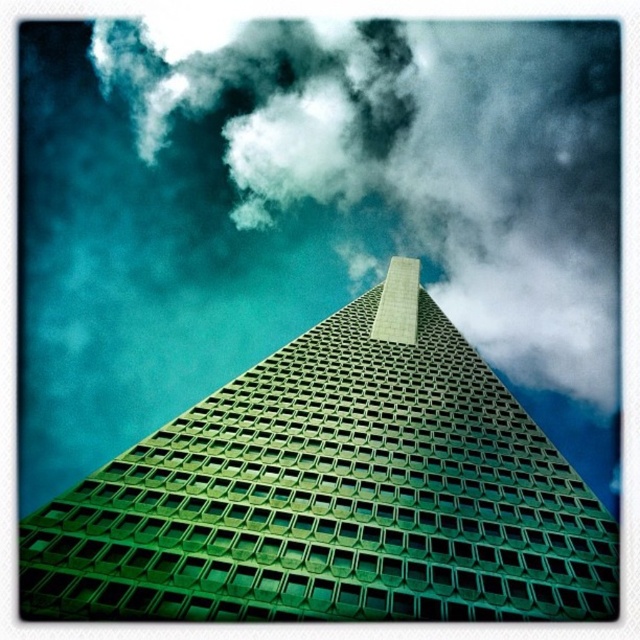
Does green glassy building at center appear on the right side of white fluffy cloud at upper center?

Incorrect, green glassy building at center is not on the right side of white fluffy cloud at upper center.

Does point (352, 348) lie in front of point (540, 124)?

Yes, it is.

Find the location of a particular element. green glassy building at center is located at coordinates (336, 493).